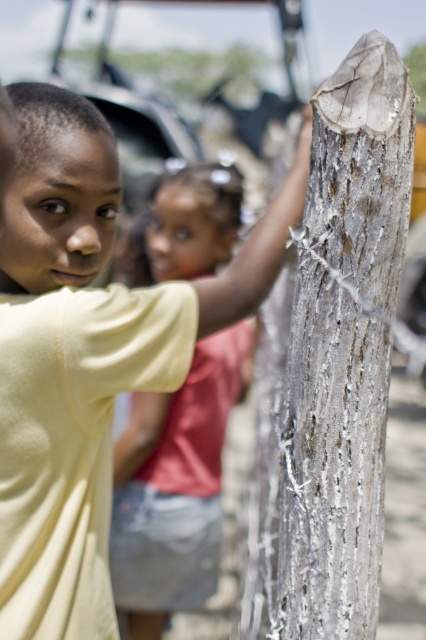
Question: Does yellow matte shirt at upper left appear on the left side of gray rough wood post at right?

Choices:
 (A) yes
 (B) no

Answer: (A)

Question: Which object is farther from the camera taking this photo?

Choices:
 (A) yellow matte shirt at upper left
 (B) gray rough wood post at right
 (C) matte yellow shirt at center

Answer: (C)

Question: Can you confirm if gray rough wood post at right is thinner than matte yellow shirt at center?

Choices:
 (A) yes
 (B) no

Answer: (A)

Question: Does gray rough wood post at right appear under matte yellow shirt at center?

Choices:
 (A) yes
 (B) no

Answer: (A)

Question: Among these points, which one is nearest to the camera?

Choices:
 (A) (20, 291)
 (B) (334, 157)
 (C) (147, 572)

Answer: (B)

Question: Which object is closer to the camera taking this photo?

Choices:
 (A) matte yellow shirt at center
 (B) yellow matte shirt at upper left
 (C) gray rough wood post at right

Answer: (B)